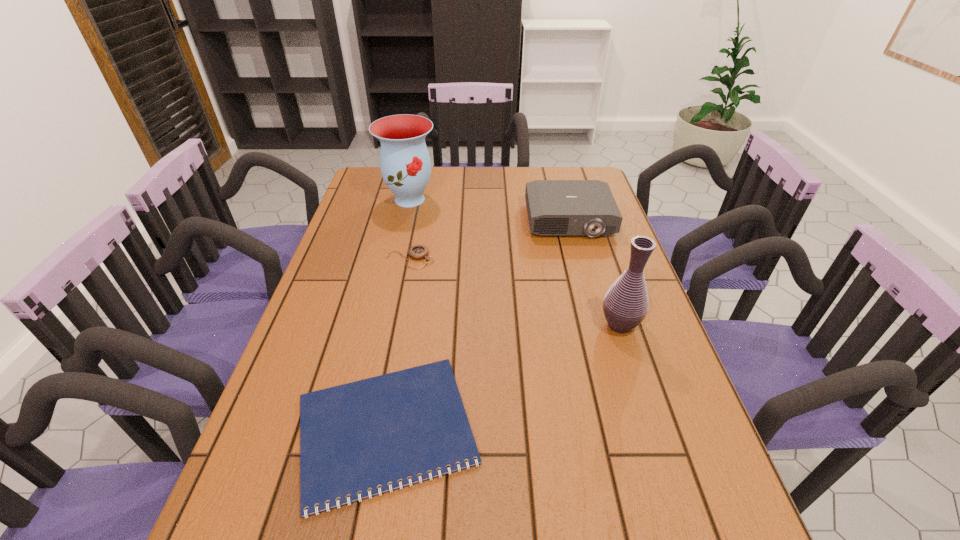
Identify the location of vacant area that lies between the fourth tallest object and the farther vase. (410, 229).

Where is `vacant region between the left vase and the right vase`? This screenshot has height=540, width=960. vacant region between the left vase and the right vase is located at coordinates (515, 262).

Locate an element on the screen. The width and height of the screenshot is (960, 540). empty space that is in between the third nearest object and the left vase is located at coordinates (410, 229).

Identify which object is the third closest to the projector. Please provide its 2D coordinates. Your answer should be formatted as a tuple, i.e. [(x, y)], where the tuple contains the x and y coordinates of a point satisfying the conditions above.

[(625, 306)]

Identify which object is the nearest to the farther vase. Please provide its 2D coordinates. Your answer should be formatted as a tuple, i.e. [(x, y)], where the tuple contains the x and y coordinates of a point satisfying the conditions above.

[(417, 252)]

Find the location of a particular element. The width and height of the screenshot is (960, 540). vacant space that satisfies the following two spatial constraints: 1. on the front side of the notepad; 2. on the right side of the pocket watch is located at coordinates (377, 429).

Find the location of `vacant point that satisfies the following two spatial constraints: 1. on the front side of the third nearest object; 2. on the right side of the nearest object`. vacant point that satisfies the following two spatial constraints: 1. on the front side of the third nearest object; 2. on the right side of the nearest object is located at coordinates [x=377, y=429].